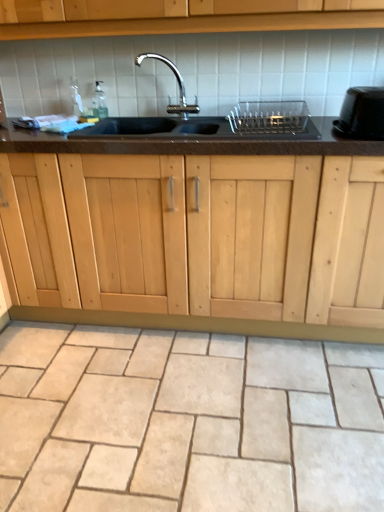
This screenshot has height=512, width=384. Find the location of `black granite sink at center`. black granite sink at center is located at coordinates (209, 120).

The width and height of the screenshot is (384, 512). I want to click on black glossy toaster at right, the second appliance positioned from the left, so click(362, 114).

Is black granite sink at center completely or partially inside beige stone tile at lower center?

No, black granite sink at center is located outside of beige stone tile at lower center.

Considering the positions of points (181, 470) and (187, 105), is point (181, 470) farther from camera compared to point (187, 105)?

No, it is not.

Considering the relative positions of beige stone tile at lower center and black granite sink at center in the image provided, is beige stone tile at lower center to the left or to the right of black granite sink at center?

Clearly, beige stone tile at lower center is on the left of black granite sink at center in the image.

How much distance is there between beige stone tile at lower center and black granite sink at center?

beige stone tile at lower center is 3.41 feet from black granite sink at center.

Can you tell me how much black granite sink at center and clear plastic dish rack at center, acting as the second appliance starting from the right, differ in facing direction?

The angle between the facing direction of black granite sink at center and the facing direction of clear plastic dish rack at center, acting as the second appliance starting from the right, is 0.327 degrees.

From the image's perspective, is black granite sink at center over clear plastic dish rack at center, acting as the second appliance starting from the right?

Yes, from the image's perspective, black granite sink at center is on top of clear plastic dish rack at center, acting as the second appliance starting from the right.

Does black granite sink at center lie in front of clear plastic dish rack at center, acting as the second appliance starting from the right?

Yes, black granite sink at center is closer to the viewer.

Are black granite sink at center and clear plastic dish rack at center, acting as the second appliance starting from the right, located far from each other?

That's not correct — black granite sink at center is a little close to clear plastic dish rack at center, acting as the second appliance starting from the right.

Does black glossy toaster at right, the 1th appliance viewed from the right, touch clear plastic dish rack at center, the first appliance positioned from the left?

No.

Which is in front, point (383, 105) or point (280, 119)?

The point (383, 105) is closer.

Looking at this image, does black glossy toaster at right, the second appliance positioned from the left, have a smaller size compared to clear plastic dish rack at center, acting as the second appliance starting from the right?

No.

Based on their sizes in the image, would you say black granite sink at center is bigger or smaller than beige stone tile at lower center?

Clearly, black granite sink at center is larger in size than beige stone tile at lower center.

Locate an element on the screen. Image resolution: width=384 pixels, height=512 pixels. sink that is on the right side of beige stone tile at lower center is located at coordinates (209, 120).

Measure the distance from black granite sink at center to beige stone tile at lower center.

black granite sink at center and beige stone tile at lower center are 3.41 feet apart from each other.

Is black granite sink at center located outside beige stone tile at lower center?

Yes, black granite sink at center is not within beige stone tile at lower center.

Is black glossy toaster at right, the second appliance positioned from the left, facing towards black granite sink at center?

No, black glossy toaster at right, the second appliance positioned from the left, is not aimed at black granite sink at center.

Could you measure the distance between black glossy toaster at right, the 1th appliance viewed from the right, and black granite sink at center?

A distance of 49.23 centimeters exists between black glossy toaster at right, the 1th appliance viewed from the right, and black granite sink at center.

Is black glossy toaster at right, the 1th appliance viewed from the right, far from black granite sink at center?

They are positioned close to each other.

Is black granite sink at center located within black glossy toaster at right, the second appliance positioned from the left?

Actually, black granite sink at center is outside black glossy toaster at right, the second appliance positioned from the left.

In the image, is beige stone tile at lower center positioned in front of or behind black glossy toaster at right, the 1th appliance viewed from the right?

beige stone tile at lower center is in front of black glossy toaster at right, the 1th appliance viewed from the right.

Considering the relative positions of beige stone tile at lower center and black glossy toaster at right, the second appliance positioned from the left, in the image provided, is beige stone tile at lower center to the right of black glossy toaster at right, the second appliance positioned from the left, from the viewer's perspective?

No, beige stone tile at lower center is not to the right of black glossy toaster at right, the second appliance positioned from the left.

Does beige stone tile at lower center contain black glossy toaster at right, the 1th appliance viewed from the right?

Actually, black glossy toaster at right, the 1th appliance viewed from the right, is outside beige stone tile at lower center.

Looking at this image, measure the distance between beige stone tile at lower center and black glossy toaster at right, the 1th appliance viewed from the right.

3.76 feet.

Which object is further away from the camera, clear plastic dish rack at center, the first appliance positioned from the left, or beige stone tile at lower center?

clear plastic dish rack at center, the first appliance positioned from the left.

From the image's perspective, which is above, clear plastic dish rack at center, acting as the second appliance starting from the right, or beige stone tile at lower center?

clear plastic dish rack at center, acting as the second appliance starting from the right, is shown above in the image.

Measure the distance between clear plastic dish rack at center, acting as the second appliance starting from the right, and beige stone tile at lower center.

The distance of clear plastic dish rack at center, acting as the second appliance starting from the right, from beige stone tile at lower center is 1.13 meters.

Does clear plastic dish rack at center, the first appliance positioned from the left, touch beige stone tile at lower center?

No, clear plastic dish rack at center, the first appliance positioned from the left, is not in contact with beige stone tile at lower center.

At what (x,y) coordinates should I click in order to perform the action: click on sink located above the beige stone tile at lower center (from a real-world perspective). Please return your answer as a coordinate pair (x, y). The image size is (384, 512). Looking at the image, I should click on (209, 120).

Where is `sink below the clear plastic dish rack at center, the first appliance positioned from the left (from a real-world perspective)`? Image resolution: width=384 pixels, height=512 pixels. sink below the clear plastic dish rack at center, the first appliance positioned from the left (from a real-world perspective) is located at coordinates (209, 120).

Estimate the real-world distances between objects in this image. Which object is further from black glossy toaster at right, the second appliance positioned from the left, clear plastic dish rack at center, acting as the second appliance starting from the right, or beige stone tile at lower center?

beige stone tile at lower center.

Looking at the image, which one is located further to black granite sink at center, black glossy toaster at right, the second appliance positioned from the left, or clear plastic dish rack at center, acting as the second appliance starting from the right?

black glossy toaster at right, the second appliance positioned from the left, is further to black granite sink at center.

Looking at the image, which one is located further to black glossy toaster at right, the 1th appliance viewed from the right, black granite sink at center or beige stone tile at lower center?

beige stone tile at lower center is positioned further to the anchor black glossy toaster at right, the 1th appliance viewed from the right.

Which object lies further to the anchor point black granite sink at center, black glossy toaster at right, the 1th appliance viewed from the right, or beige stone tile at lower center?

beige stone tile at lower center is further to black granite sink at center.

Estimate the real-world distances between objects in this image. Which object is further from clear plastic dish rack at center, the first appliance positioned from the left, black granite sink at center or beige stone tile at lower center?

beige stone tile at lower center is positioned further to the anchor clear plastic dish rack at center, the first appliance positioned from the left.

In the scene shown: When comparing their distances from clear plastic dish rack at center, the first appliance positioned from the left, does beige stone tile at lower center or black granite sink at center seem further?

beige stone tile at lower center is further to clear plastic dish rack at center, the first appliance positioned from the left.

Considering their positions, is black glossy toaster at right, the second appliance positioned from the left, positioned closer to beige stone tile at lower center than clear plastic dish rack at center, acting as the second appliance starting from the right?

Based on the image, clear plastic dish rack at center, acting as the second appliance starting from the right, appears to be nearer to beige stone tile at lower center.

Which object lies further to the anchor point black granite sink at center, beige stone tile at lower center or black glossy toaster at right, the second appliance positioned from the left?

beige stone tile at lower center is further to black granite sink at center.

In order to click on appliance between clear plastic dish rack at center, the first appliance positioned from the left, and beige stone tile at lower center in the up-down direction in this screenshot , I will do coord(362,114).

I want to click on appliance between black granite sink at center and black glossy toaster at right, the second appliance positioned from the left, in the horizontal direction, so [x=269, y=118].